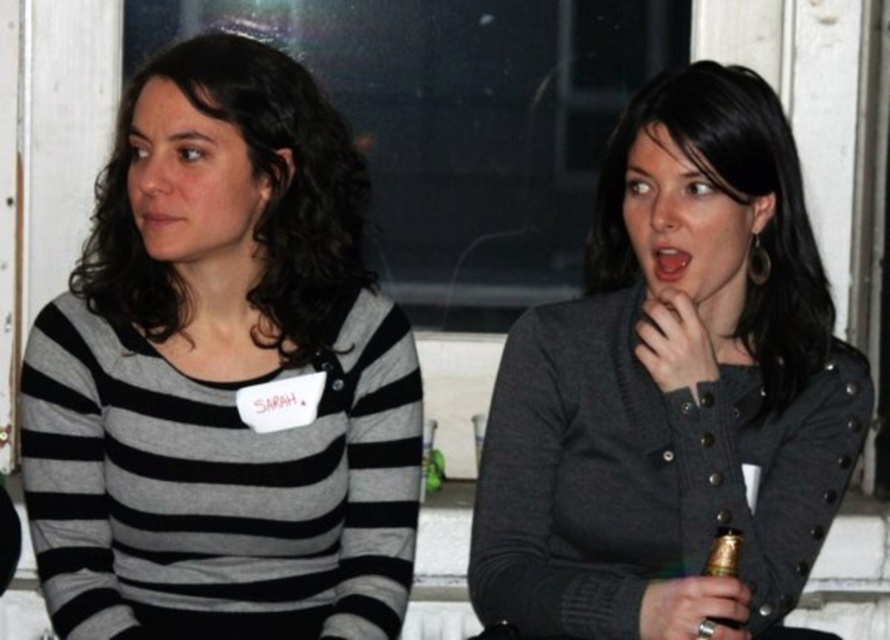
You are a photographer setting up a portrait shoot and notice the striped cotton shirt at left and the dark gray sweater at center in the frame. Which piece of clothing should you adjust in your composition to ensure both are equally visible? Explain your reasoning.

The striped cotton shirt at left is further to the viewer than the dark gray sweater at center, so you should move the dark gray sweater at center closer to the camera to align their distances and ensure both are equally visible.

You are standing in front of the image and want to determine which of the two points, point (57, 573) or point (646, 211), is nearer to you. Based on the scene, which point is closer?

Point (57, 573) is closer to the viewer than point (646, 211).